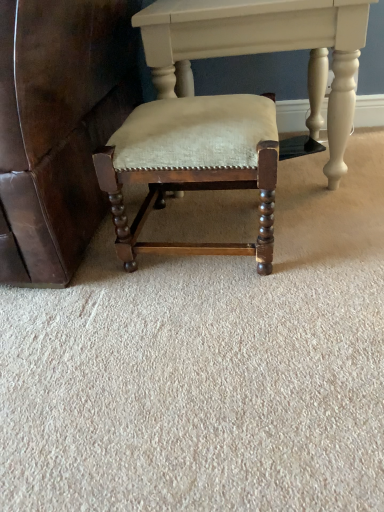
Question: From the image's perspective, relative to matte wood chair at center, is matte white table at center above or below?

Choices:
 (A) below
 (B) above

Answer: (B)

Question: Considering their positions, is matte white table at center located in front of or behind matte wood chair at center?

Choices:
 (A) behind
 (B) front

Answer: (A)

Question: Is point (139, 12) positioned closer to the camera than point (183, 66)?

Choices:
 (A) closer
 (B) farther

Answer: (A)

Question: Does point (268, 151) appear closer or farther from the camera than point (185, 86)?

Choices:
 (A) farther
 (B) closer

Answer: (B)

Question: Looking at their shapes, would you say matte wood chair at center is wider or thinner than matte white table at center?

Choices:
 (A) wide
 (B) thin

Answer: (B)

Question: Is matte wood chair at center in front of or behind matte white table at center in the image?

Choices:
 (A) front
 (B) behind

Answer: (A)

Question: Is matte wood chair at center inside the boundaries of matte white table at center, or outside?

Choices:
 (A) inside
 (B) outside

Answer: (B)